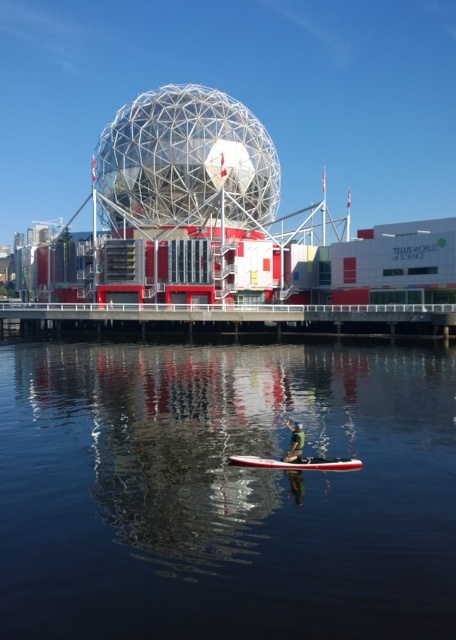
Measure the distance between point [82,512] and camera.

129.12 feet

Between transparent water at center and white glossy canoe at center, which one is positioned lower?

white glossy canoe at center is lower down.

Locate an element on the screen. The width and height of the screenshot is (456, 640). transparent water at center is located at coordinates (224, 492).

Which of these two, transparent water at center or green fabric at center, stands shorter?

green fabric at center

Which is above, transparent water at center or green fabric at center?

Positioned higher is transparent water at center.

Is point (368, 444) positioned in front of point (298, 429)?

No, it is not.

Locate an element on the screen. This screenshot has height=640, width=456. transparent water at center is located at coordinates (224, 492).

Does transparent water at center have a lesser height compared to white glossy dock at center?

No, transparent water at center is not shorter than white glossy dock at center.

Measure the distance between transparent water at center and white glossy dock at center.

The distance of transparent water at center from white glossy dock at center is 26.23 meters.

Between point (264, 500) and point (419, 324), which one is positioned behind?

The point (419, 324) is behind.

This screenshot has height=640, width=456. I want to click on transparent water at center, so click(x=224, y=492).